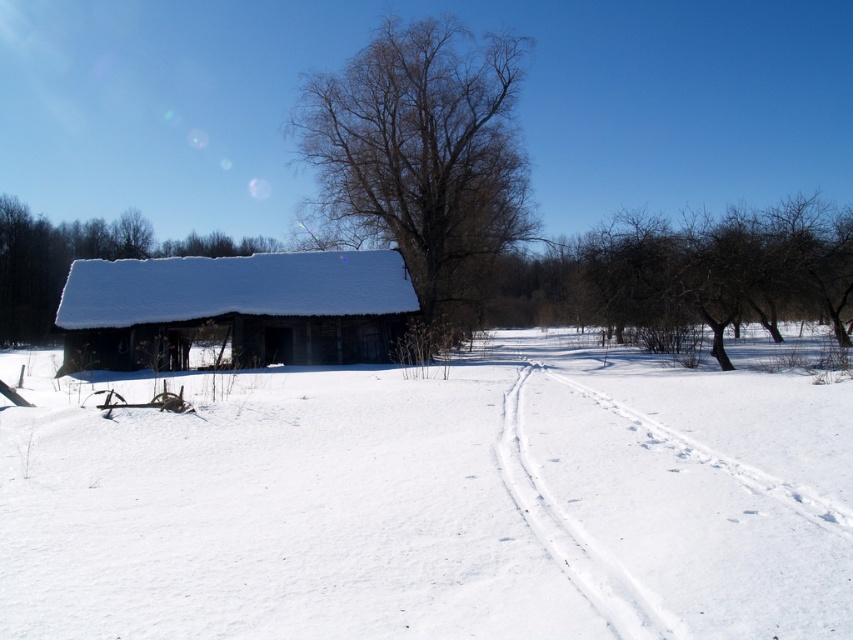
Question: Can you confirm if white fluffy snow at center is positioned to the left of white snow track at lower right?

Choices:
 (A) no
 (B) yes

Answer: (B)

Question: Does white snow track at lower right have a lesser width compared to snow-covered wooden barn at center?

Choices:
 (A) yes
 (B) no

Answer: (A)

Question: Among these points, which one is nearest to the camera?

Choices:
 (A) (125, 381)
 (B) (161, 253)

Answer: (A)

Question: Which of these objects is positioned closest to the white fluffy snow at center?

Choices:
 (A) snow-covered wooden shed at left
 (B) snow-covered wooden barn at center
 (C) bare wood tree at center

Answer: (B)

Question: Estimate the real-world distances between objects in this image. Which object is closer to the bare wood tree at center?

Choices:
 (A) white fluffy snow at center
 (B) snow-covered wooden shed at left

Answer: (A)

Question: Is snow-covered wooden barn at center above snow-covered wooden shed at left?

Choices:
 (A) yes
 (B) no

Answer: (B)